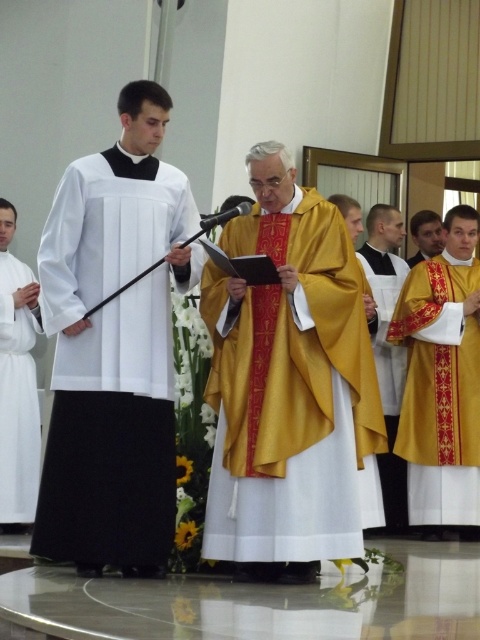
Is point (120, 410) in front of point (456, 307)?

That is True.

You are a GUI agent. You are given a task and a screenshot of the screen. Output one action in this format:
    pyautogui.click(x=<x>, y=<y>)
    Task: Click on the white pleated fabric at center
    The image size is (480, 640).
    Given the screenshot: What is the action you would take?
    pyautogui.click(x=111, y=365)

You are a GUI agent. You are given a task and a screenshot of the screen. Output one action in this format:
    pyautogui.click(x=<x>, y=<y>)
    Task: Click on the white pleated fabric at center
    
    Given the screenshot: What is the action you would take?
    pyautogui.click(x=111, y=365)

Is gold embroidered robe at right shorter than gold satin robe at right?

No.

Does gold embroidered robe at right have a lesser width compared to gold satin robe at right?

No, gold embroidered robe at right is not thinner than gold satin robe at right.

Find the location of `gold embroidered robe at right`. gold embroidered robe at right is located at coordinates (440, 390).

In the scene shown: Does white matte robe at left come behind gold satin robe at right?

That is False.

Between white matte robe at left and gold satin robe at right, which one has less height?

Standing shorter between the two is gold satin robe at right.

Is point (17, 282) farther from viewer compared to point (403, 280)?

No, (17, 282) is in front of (403, 280).

Identify the location of white matte robe at left. The width and height of the screenshot is (480, 640). (17, 396).